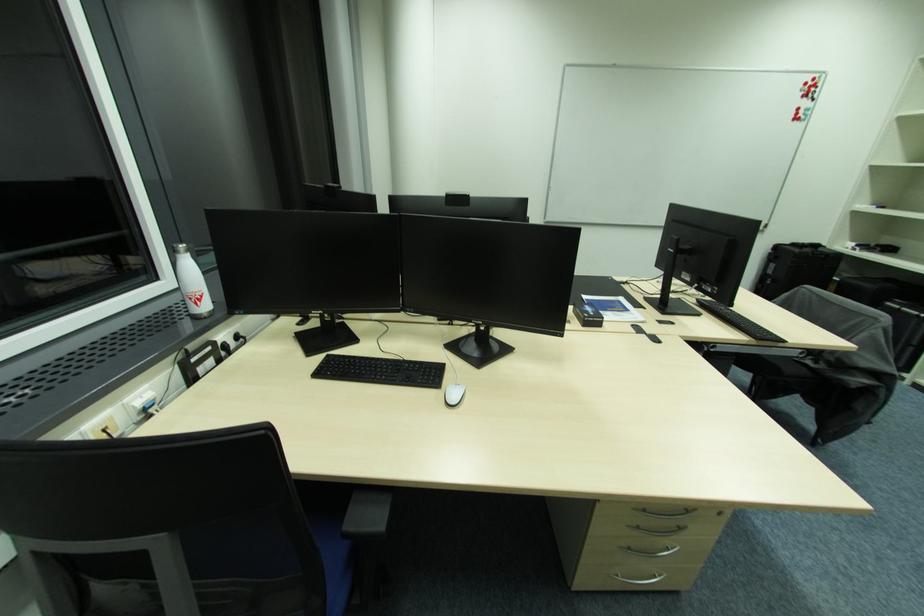
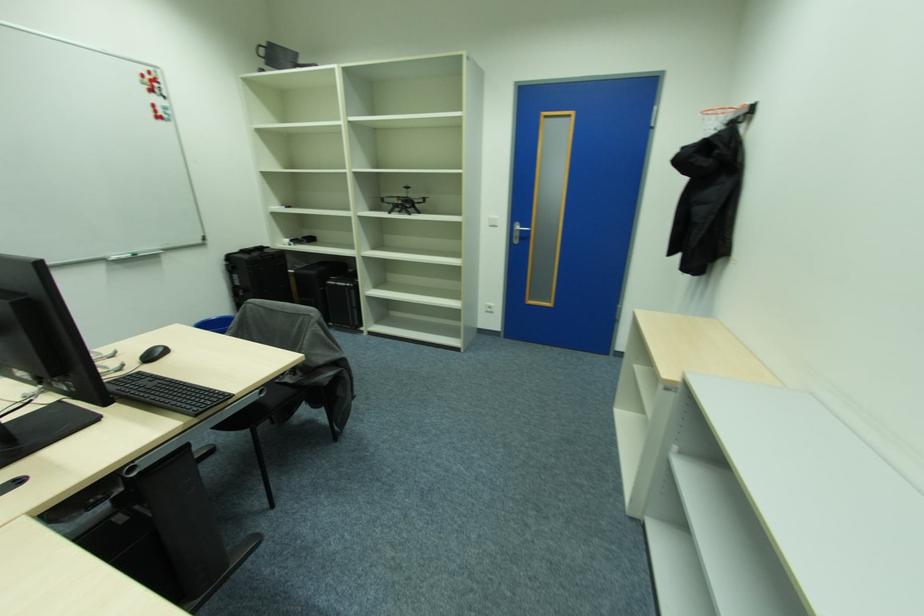
Question: The images are taken continuously from a first-person perspective. In which direction is your viewpoint rotating?

Choices:
 (A) Left
 (B) Right
 (C) Up
 (D) Down

Answer: (B)